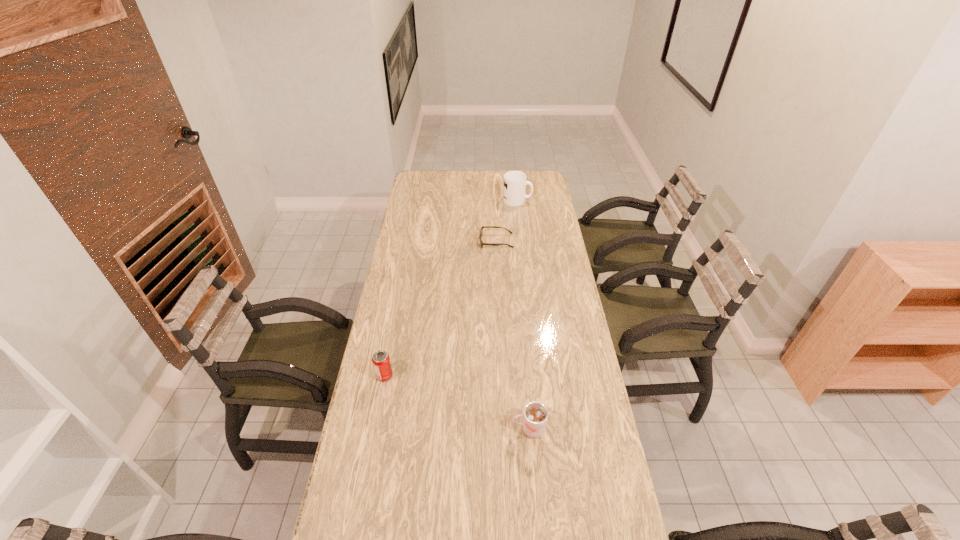
Where is `free location at the far left corner of the desktop`? free location at the far left corner of the desktop is located at coordinates (410, 192).

Locate an element on the screen. free spot between the second nearest object and the tallest object is located at coordinates (451, 288).

Locate an element on the screen. Image resolution: width=960 pixels, height=540 pixels. free area in between the sunglasses and the tallest object is located at coordinates (507, 221).

I want to click on vacant area between the cup and the mug, so click(523, 315).

Locate an element on the screen. The width and height of the screenshot is (960, 540). vacant space that's between the tallest object and the soda can is located at coordinates (451, 288).

Image resolution: width=960 pixels, height=540 pixels. What are the coordinates of `unoccupied area between the shortest object and the second nearest object` in the screenshot? It's located at (441, 308).

In order to click on the second closest object to the farthest object in this screenshot , I will do `click(381, 362)`.

Identify which object is located as the third nearest to the third farthest object. Please provide its 2D coordinates. Your answer should be formatted as a tuple, i.e. [(x, y)], where the tuple contains the x and y coordinates of a point satisfying the conditions above.

[(515, 182)]

This screenshot has width=960, height=540. I want to click on vacant space that satisfies the following two spatial constraints: 1. on the handle side of the mug; 2. on the front side of the soda can, so click(x=538, y=375).